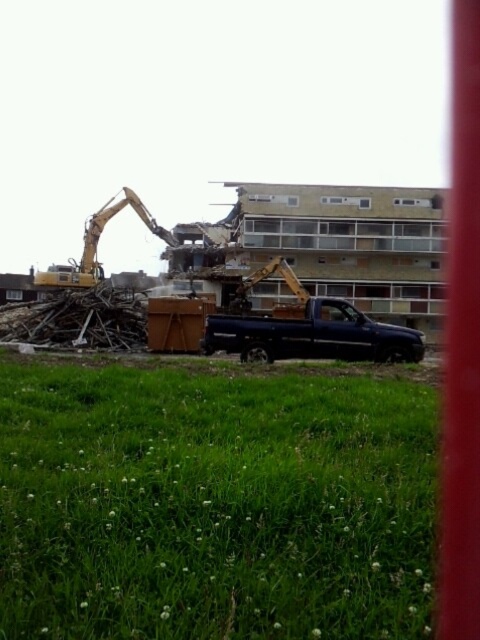
You are a construction worker who needs to move a heavy equipment from the yellow metallic excavator at left to the green grassy field at lower center. What is the shortest distance you need to cover?

The shortest distance you need to cover is 13.49 meters between the yellow metallic excavator at left and the green grassy field at lower center.

You are a construction worker who needs to move a heavy load from the matte black truck at center to the yellow metallic excavator at left. The path between them is clear, but you have a forklift that has a maximum reach of 40 feet. Can your forklift safely transport the load without needing to move the truck or excavator?

The distance between the matte black truck at center and the yellow metallic excavator at left is 42.17 feet, which exceeds the forklifts maximum reach of 40 feet. Therefore, the forklift cannot safely transport the load without adjusting the positions of the truck or excavator.